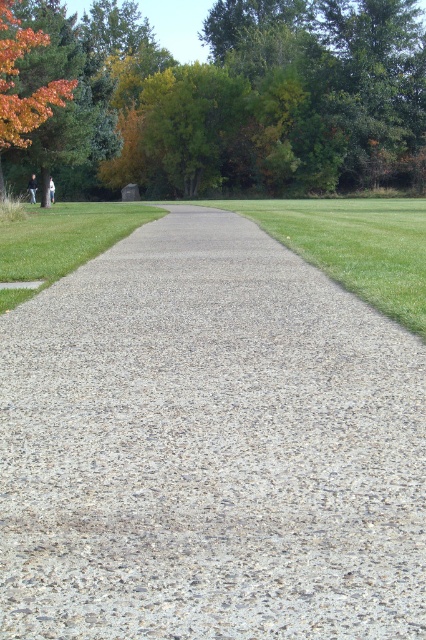
Can you confirm if green leafy tree at upper center is positioned to the right of green grass at center?

No, green leafy tree at upper center is not to the right of green grass at center.

Between point (236, 164) and point (282, 243), which one is positioned behind?

The point (236, 164) is more distant.

What are the coordinates of `green leafy tree at upper center` in the screenshot? It's located at (232, 99).

Is point (327, 61) less distant than point (0, 93)?

No.

Is green leafy tree at upper center smaller than orange leafy tree at upper left?

No, green leafy tree at upper center is not smaller than orange leafy tree at upper left.

Is point (340, 150) behind point (3, 3)?

That is True.

The width and height of the screenshot is (426, 640). Identify the location of green leafy tree at upper center. (232, 99).

How far apart are gray gravel at center and orange leafy tree at upper left?

gray gravel at center and orange leafy tree at upper left are 21.11 meters apart from each other.

Can you confirm if gray gravel at center is bigger than orange leafy tree at upper left?

No, gray gravel at center is not bigger than orange leafy tree at upper left.

Identify the location of gray gravel at center. The width and height of the screenshot is (426, 640). (209, 448).